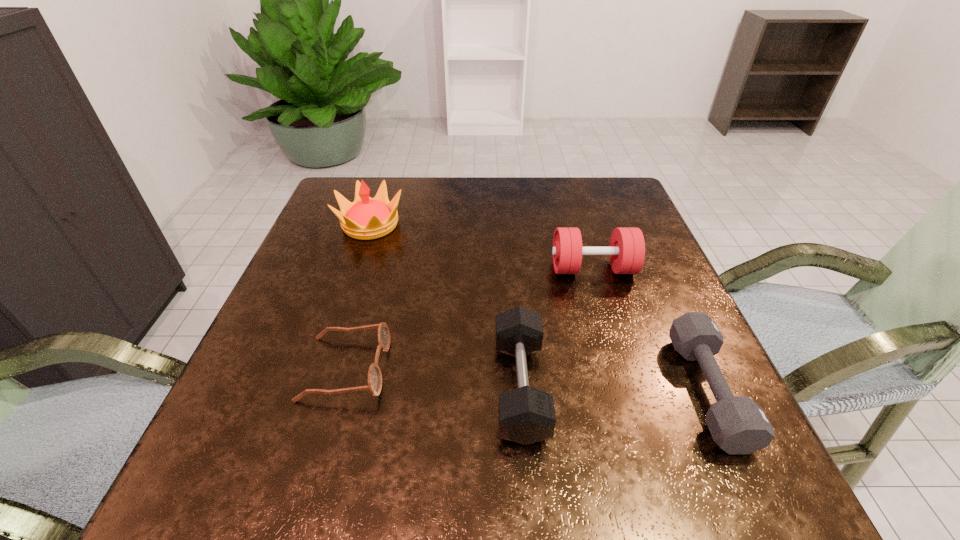
The image size is (960, 540). I want to click on vacant space at the right edge of the desktop, so click(x=656, y=355).

This screenshot has width=960, height=540. In the image, there is a desktop. What are the coordinates of `vacant space at the far left corner` in the screenshot? It's located at (322, 216).

Locate an element on the screen. This screenshot has height=540, width=960. free space at the far right corner of the desktop is located at coordinates (586, 183).

At what (x,y) coordinates should I click in order to perform the action: click on vacant area that lies between the farthest dumbbell and the crown. Please return your answer as a coordinate pair (x, y). Looking at the image, I should click on (482, 247).

The width and height of the screenshot is (960, 540). What are the coordinates of `vacant space that is in between the crown and the fourth tallest object` in the screenshot? It's located at (539, 308).

The image size is (960, 540). In order to click on free spot between the third object from right to left and the farthest object in this screenshot , I will do `click(445, 306)`.

At what (x,y) coordinates should I click in order to perform the action: click on blank region between the second shortest object and the third object from left to right. Please return your answer as a coordinate pair (x, y). The width and height of the screenshot is (960, 540). Looking at the image, I should click on pyautogui.click(x=614, y=389).

I want to click on empty space that is in between the leftmost dumbbell and the farthest object, so click(445, 306).

Locate an element on the screen. The image size is (960, 540). free spot between the farthest dumbbell and the shortest dumbbell is located at coordinates (650, 330).

Locate an element on the screen. Image resolution: width=960 pixels, height=540 pixels. vacant area that lies between the farthest object and the shortest dumbbell is located at coordinates (539, 308).